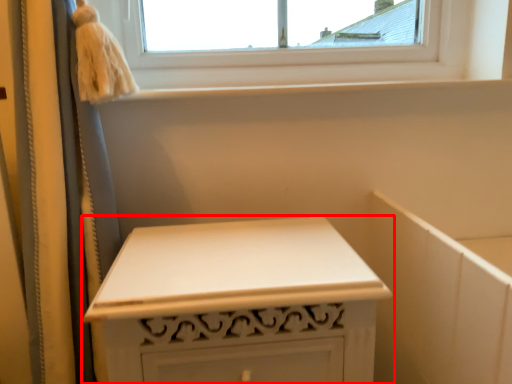
Question: From the image's perspective, considering the relative positions of furniture (annotated by the red box) and window sill in the image provided, where is furniture (annotated by the red box) located with respect to the staircase?

Choices:
 (A) below
 (B) above

Answer: (A)